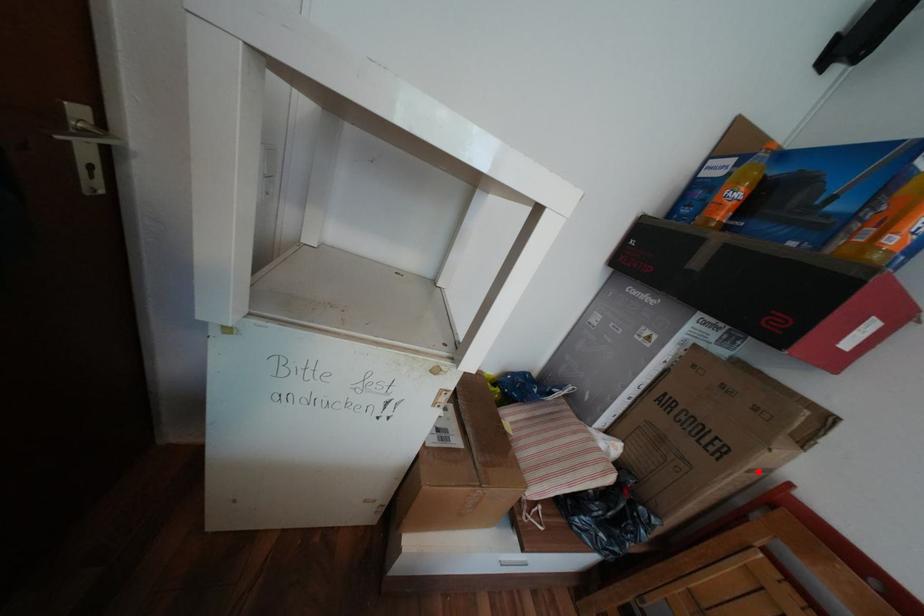
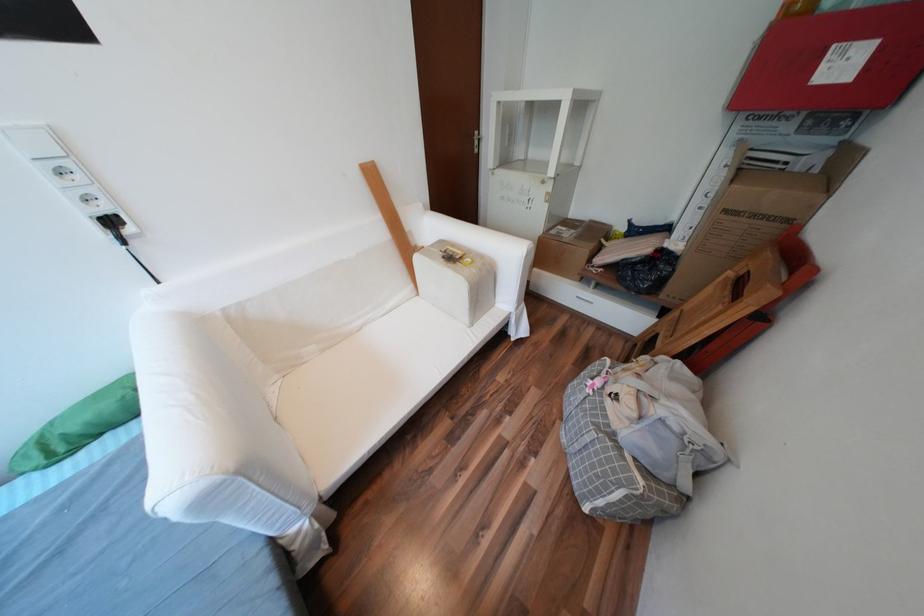
In the second image, find the point that corresponds to the highlighted location in the first image.

(736, 211)